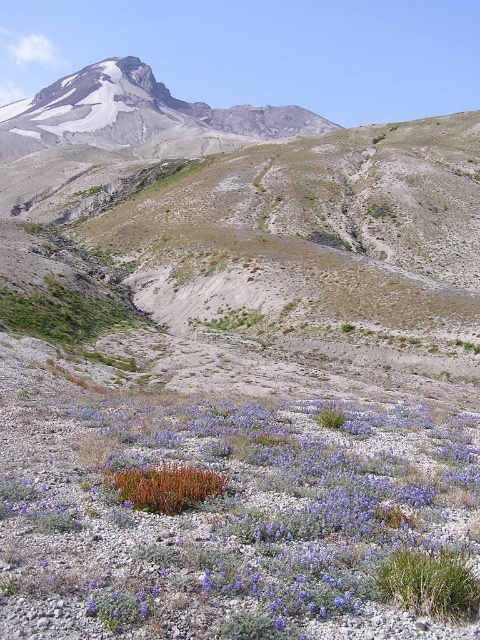
Does snowy rocky peak at upper center have a lesser height compared to green grass at lower right?

No, snowy rocky peak at upper center is not shorter than green grass at lower right.

Is snowy rocky peak at upper center positioned in front of green grass at lower right?

No, it is not.

Is point (253, 131) closer to viewer compared to point (420, 582)?

No, it is not.

Locate an element on the screen. snowy rocky peak at upper center is located at coordinates (135, 113).

Is point (92, 513) positioned in front of point (420, 557)?

That is False.

What do you see at coordinates (241, 524) in the screenshot?
I see `purple soft-textured flowers at center` at bounding box center [241, 524].

Locate an element on the screen. This screenshot has width=480, height=640. purple soft-textured flowers at center is located at coordinates (241, 524).

Does purple soft-textured flowers at center have a larger size compared to snowy rocky peak at upper center?

Incorrect, purple soft-textured flowers at center is not larger than snowy rocky peak at upper center.

Does purple soft-textured flowers at center have a lesser height compared to snowy rocky peak at upper center?

Yes.

Which is behind, point (440, 625) or point (263, 131)?

The point (263, 131) is behind.

Locate an element on the screen. The width and height of the screenshot is (480, 640). purple soft-textured flowers at center is located at coordinates (241, 524).